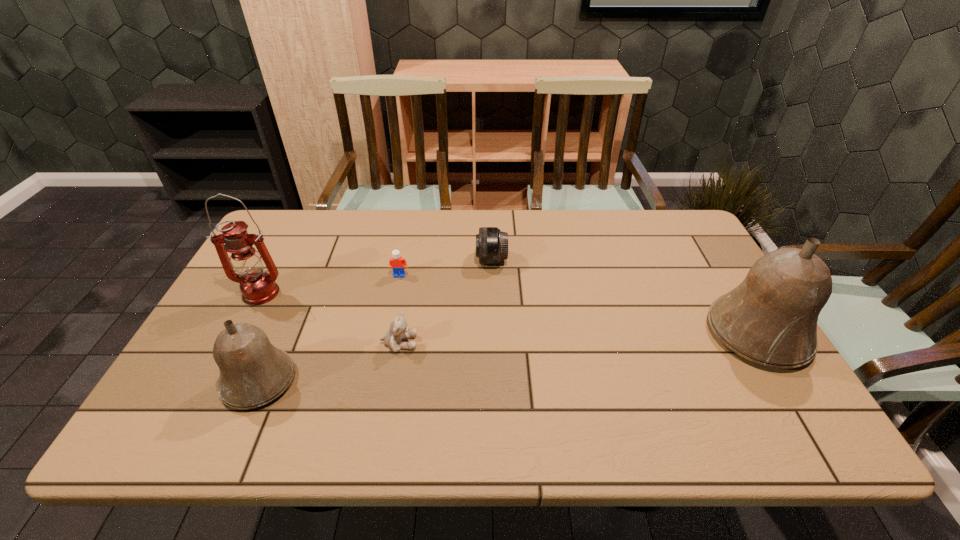
Identify the location of free spot between the Lego and the farthest object. (445, 268).

Where is `vacant area between the right bell and the oil lamp`? This screenshot has width=960, height=540. vacant area between the right bell and the oil lamp is located at coordinates (509, 313).

Locate an element on the screen. This screenshot has height=540, width=960. vacant area that lies between the farthest object and the teddy bear is located at coordinates (445, 302).

The height and width of the screenshot is (540, 960). Find the location of `vacant space in between the fifth object from left to right and the right bell`. vacant space in between the fifth object from left to right and the right bell is located at coordinates (624, 297).

You are a GUI agent. You are given a task and a screenshot of the screen. Output one action in this format:
    pyautogui.click(x=<x>, y=<y>)
    Task: Click on the empty space that is in between the fifth object from left to right and the teddy bear
    Image resolution: width=960 pixels, height=540 pixels.
    Given the screenshot: What is the action you would take?
    pyautogui.click(x=445, y=302)

The image size is (960, 540). I want to click on empty space that is in between the second farthest object and the fourth shortest object, so click(x=329, y=328).

Identify the location of blank region between the teddy bear and the farthest object. (445, 302).

Point out which object is positioned as the third nearest to the Lego. Please provide its 2D coordinates. Your answer should be formatted as a tuple, i.e. [(x, y)], where the tuple contains the x and y coordinates of a point satisfying the conditions above.

[(258, 287)]

You are a GUI agent. You are given a task and a screenshot of the screen. Output one action in this format:
    pyautogui.click(x=<x>, y=<y>)
    Task: Click on the object that is the fourth closest one to the left bell
    The width and height of the screenshot is (960, 540).
    Given the screenshot: What is the action you would take?
    pyautogui.click(x=491, y=243)

You are a GUI agent. You are given a task and a screenshot of the screen. Output one action in this format:
    pyautogui.click(x=<x>, y=<y>)
    Task: Click on the free location that satisfies the following two spatial constraints: 1. on the front-facing side of the taller bell; 2. on the left side of the fifth object from left to right
    
    Given the screenshot: What is the action you would take?
    pyautogui.click(x=493, y=334)